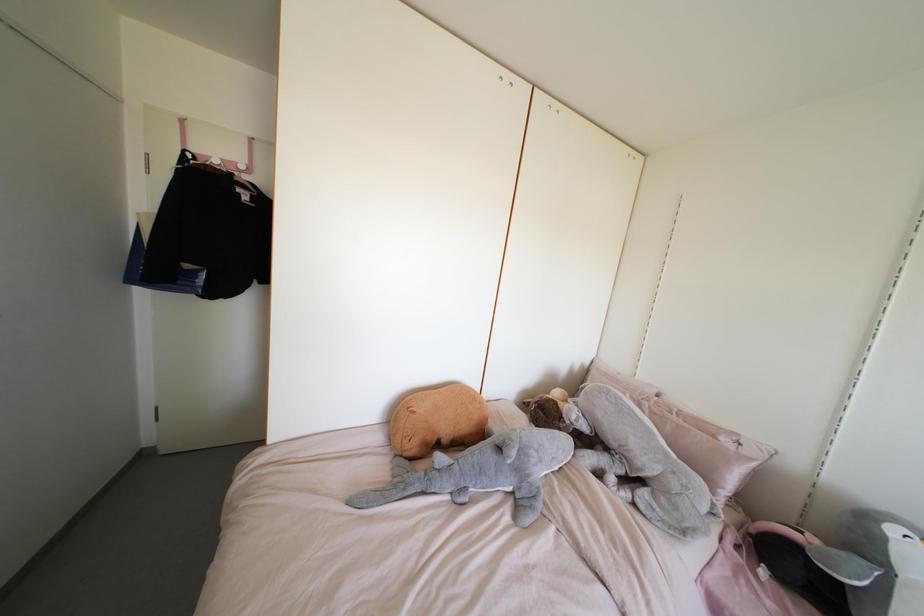
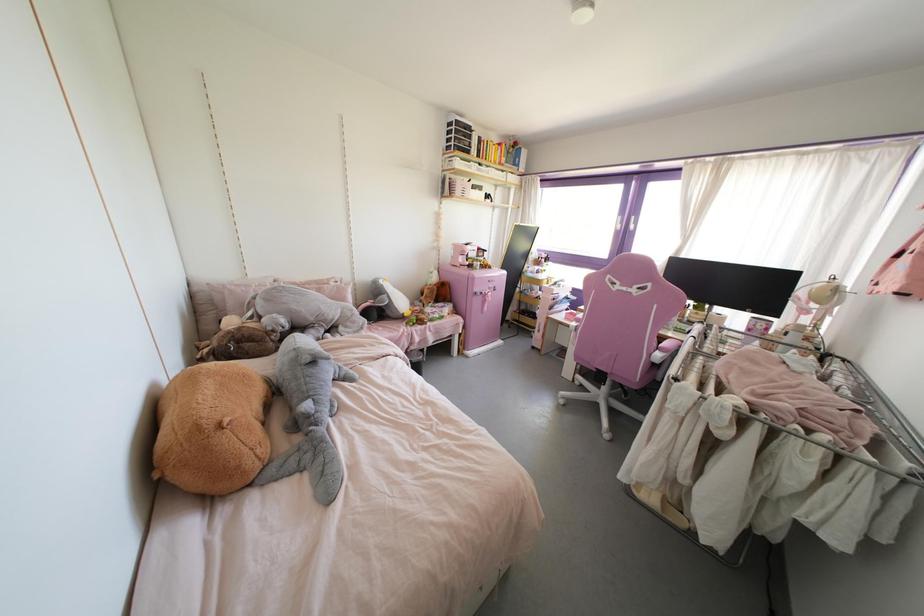
The images are taken continuously from a first-person perspective. In which direction is your viewpoint rotating?

The rotation direction of the camera is right-down.